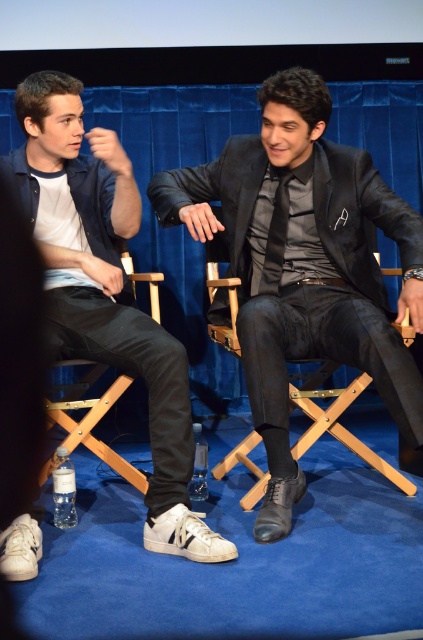
Question: Among these objects, which one is farthest from the camera?

Choices:
 (A) black leather folding chair at center
 (B) white leather sneakers at lower left
 (C) black leather shoes at center

Answer: (A)

Question: Which point appears closest to the camera in this image?

Choices:
 (A) (307, 220)
 (B) (153, 291)

Answer: (A)

Question: Is wooden folding chair at lower left to the left of silky black tie at center from the viewer's perspective?

Choices:
 (A) no
 (B) yes

Answer: (B)

Question: Can you confirm if black leather folding chair at center is positioned to the right of wooden folding chair at lower left?

Choices:
 (A) no
 (B) yes

Answer: (B)

Question: Which object appears farthest from the camera in this image?

Choices:
 (A) white leather sneakers at lower left
 (B) wooden folding chair at lower left

Answer: (A)

Question: Does white leather sneakers at lower left have a greater width compared to wooden folding chair at lower left?

Choices:
 (A) no
 (B) yes

Answer: (B)